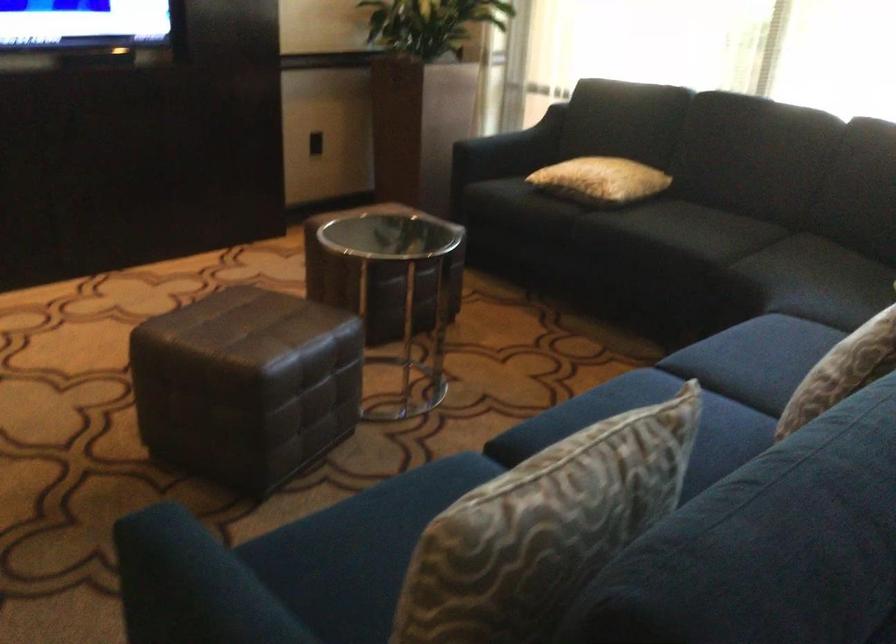
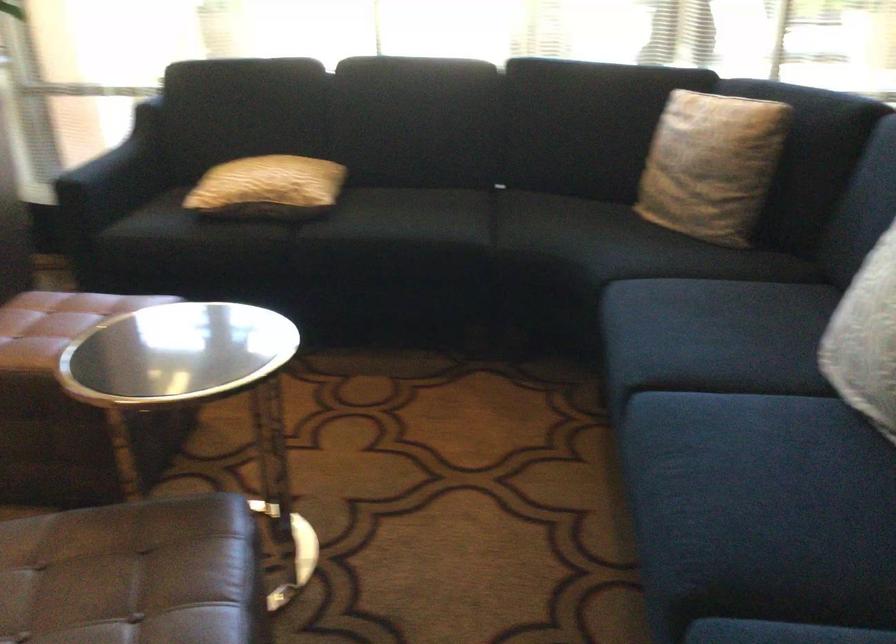
In the second image, find the point that corresponds to point (580, 176) in the first image.

(268, 187)